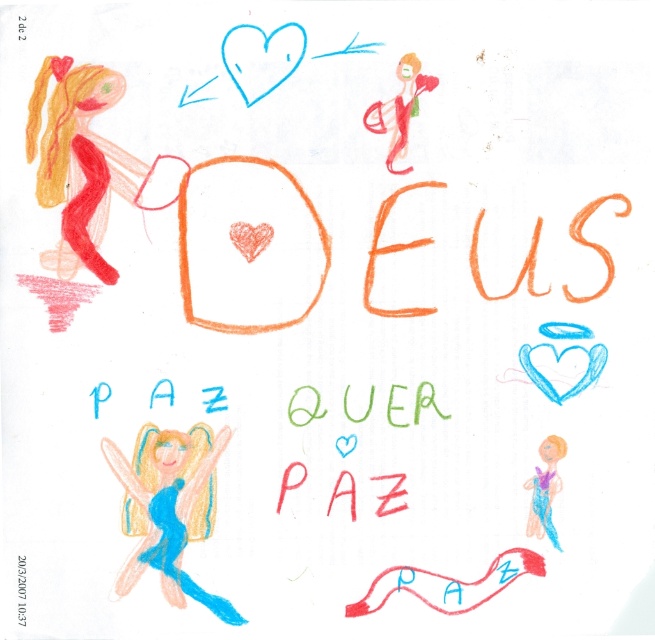
The image size is (655, 640). Find the location of `blue paper fairy at lower left`. blue paper fairy at lower left is located at coordinates (170, 508).

Based on the photo, is blue paper fairy at lower left above matte red doll at upper right?

Incorrect, blue paper fairy at lower left is not positioned above matte red doll at upper right.

Which is behind, point (140, 433) or point (373, 104)?

Point (373, 104)

The height and width of the screenshot is (640, 655). What are the coordinates of `blue paper fairy at lower left` in the screenshot? It's located at (170, 508).

In the scene shown: Between blue paper fairy at lower left and pastel purple fabric girl at lower right, which one appears on the right side from the viewer's perspective?

Positioned to the right is pastel purple fabric girl at lower right.

Which of these two, blue paper fairy at lower left or pastel purple fabric girl at lower right, stands shorter?

With less height is pastel purple fabric girl at lower right.

Between point (151, 563) and point (542, 525), which one is positioned behind?

Positioned behind is point (542, 525).

Image resolution: width=655 pixels, height=640 pixels. What are the coordinates of `blue paper fairy at lower left` in the screenshot? It's located at (170, 508).

Is matte red doll at upper right closer to camera compared to pastel purple fabric girl at lower right?

No, it is behind pastel purple fabric girl at lower right.

Does matte red doll at upper right have a larger size compared to pastel purple fabric girl at lower right?

Indeed, matte red doll at upper right has a larger size compared to pastel purple fabric girl at lower right.

Between point (403, 109) and point (534, 493), which one is positioned behind?

Positioned behind is point (403, 109).

Where is `matte red doll at upper right`? This screenshot has height=640, width=655. matte red doll at upper right is located at coordinates (400, 108).